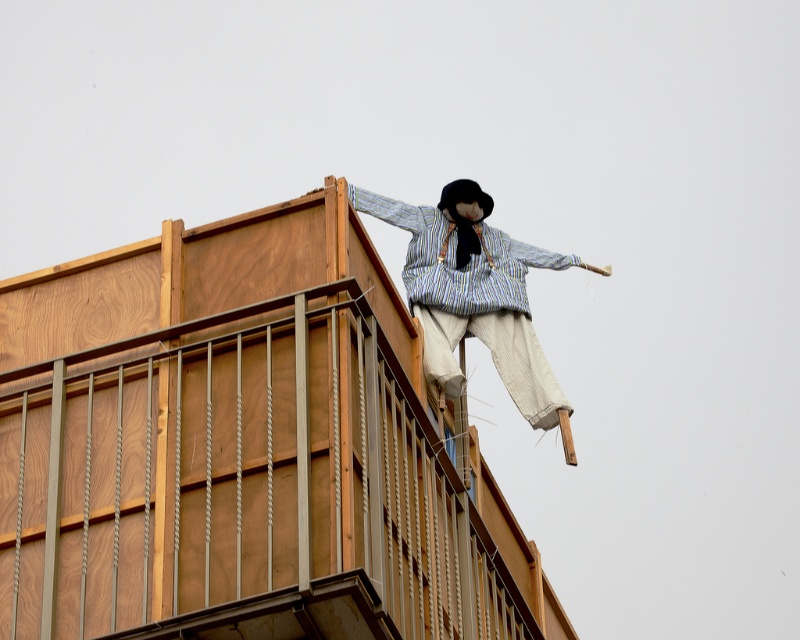
Can you confirm if wooden at upper center is bigger than striped fabric scarecrow at upper center?

Correct, wooden at upper center is larger in size than striped fabric scarecrow at upper center.

Does wooden at upper center have a lesser height compared to striped fabric scarecrow at upper center?

Incorrect, wooden at upper center's height does not fall short of striped fabric scarecrow at upper center's.

Between point (268, 529) and point (525, 300), which one is positioned behind?

Point (525, 300)

Identify the location of wooden at upper center. The image size is (800, 640). (244, 449).